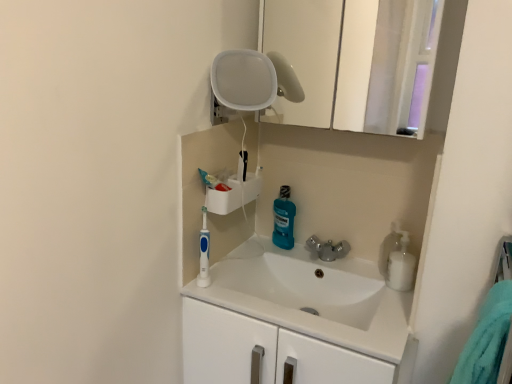
At what (x,y) coordinates should I click in order to perform the action: click on free space behind blue plastic toothbrush at center-left. Please return your answer as a coordinate pair (x, y). This screenshot has height=384, width=512. Looking at the image, I should click on (224, 263).